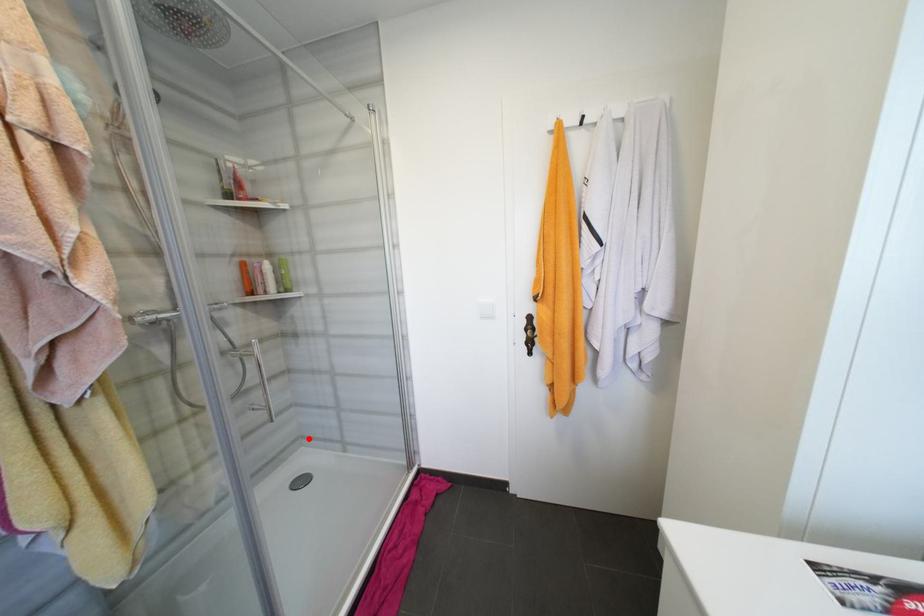
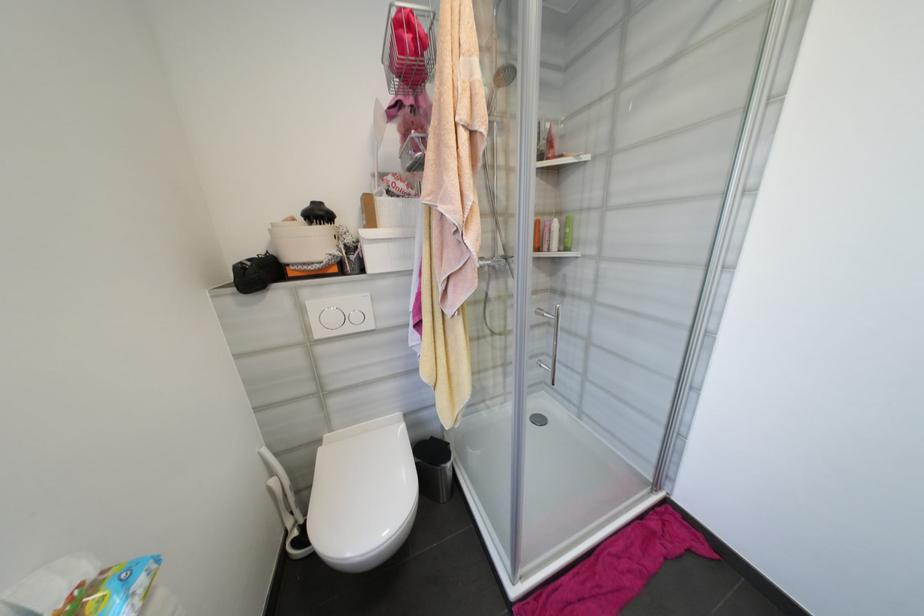
Question: I am providing you with two images of the same scene from different viewpoints. Given a red point in image1, look at the same physical point in image2. Is it:

Choices:
 (A) Closer to the viewpoint
 (B) Farther from the viewpoint

Answer: (B)